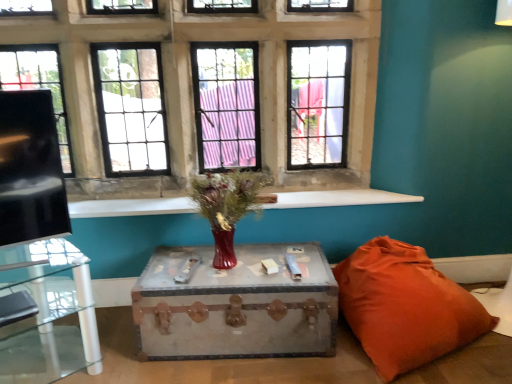
I want to click on free point to the right of matte glass vase at center, so point(295,263).